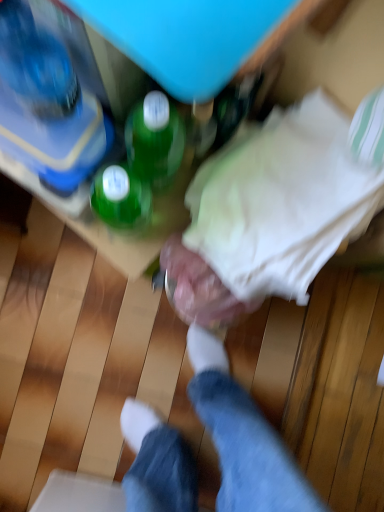
Question: Looking at the image, does white fabric at center seem bigger or smaller compared to metallic silver dumbbell at center?

Choices:
 (A) big
 (B) small

Answer: (A)

Question: From the image's perspective, is white fabric at center above or below metallic silver dumbbell at center?

Choices:
 (A) below
 (B) above

Answer: (B)

Question: Which of these objects is positioned closest to the metallic silver dumbbell at center?

Choices:
 (A) green glass bottle at upper center
 (B) translucent plastic bottle at upper left
 (C) white fabric at center

Answer: (C)

Question: Estimate the real-world distances between objects in this image. Which object is closer to the metallic silver dumbbell at center?

Choices:
 (A) green glass bottle at upper center
 (B) white fabric at center
 (C) translucent plastic bottle at upper left

Answer: (B)